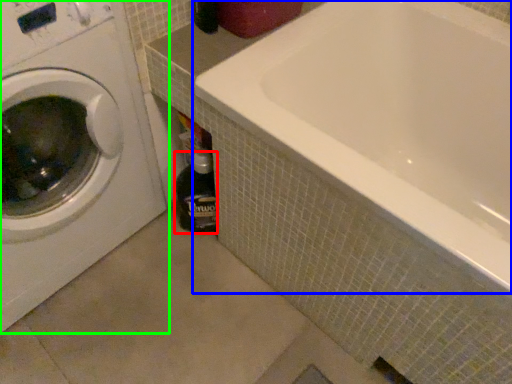
Question: Based on their relative distances, which object is farther from bottle (highlighted by a red box)? Choose from bathtub (highlighted by a blue box) and washing machine (highlighted by a green box).

Choices:
 (A) bathtub
 (B) washing machine

Answer: (A)